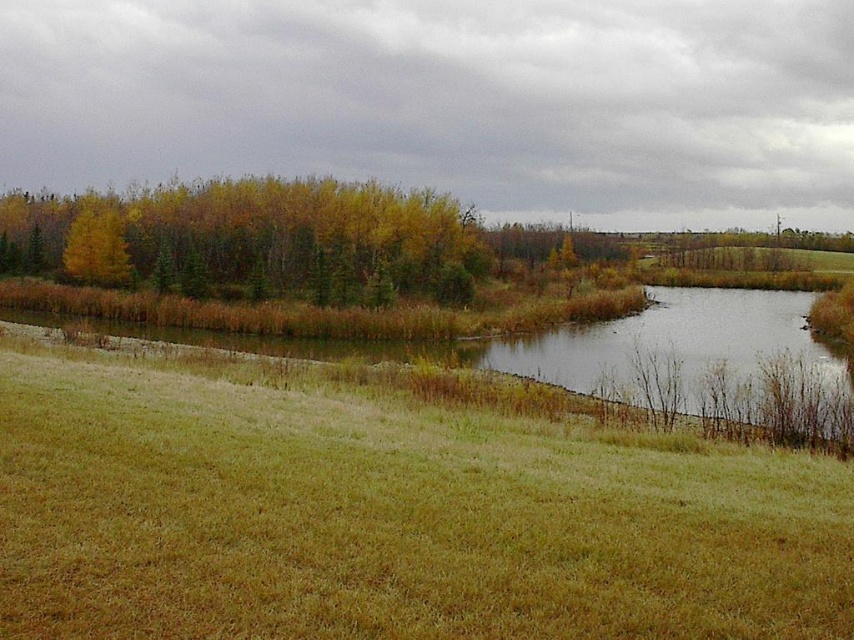
Question: Is green matte grass at center to the right of yellow-green foliage at upper left from the viewer's perspective?

Choices:
 (A) yes
 (B) no

Answer: (A)

Question: Which of the following is the closest to the observer?

Choices:
 (A) yellow leafy tree at upper left
 (B) green matte grass at center

Answer: (B)

Question: Does green matte grass at center appear on the left side of yellow leafy tree at upper left?

Choices:
 (A) yes
 (B) no

Answer: (B)

Question: Is green matte grass at center above yellow leafy tree at upper left?

Choices:
 (A) no
 (B) yes

Answer: (A)

Question: Which object is positioned closest to the yellow leafy tree at upper left?

Choices:
 (A) yellow-green foliage at upper left
 (B) green matte grass at center

Answer: (A)

Question: Estimate the real-world distances between objects in this image. Which object is farther from the yellow leafy tree at upper left?

Choices:
 (A) green matte grass at center
 (B) yellow-green foliage at upper left

Answer: (A)